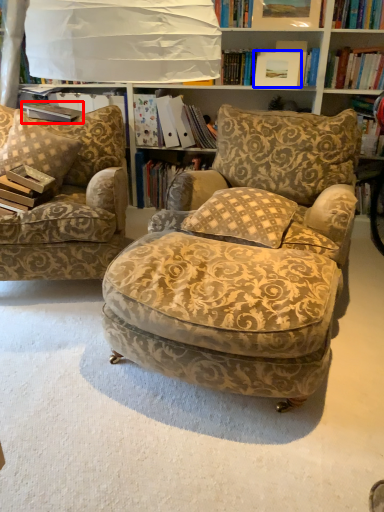
Question: Among these objects, which one is farthest to the camera, paperback book (highlighted by a red box) or picture frame (highlighted by a blue box)?

Choices:
 (A) paperback book
 (B) picture frame

Answer: (B)